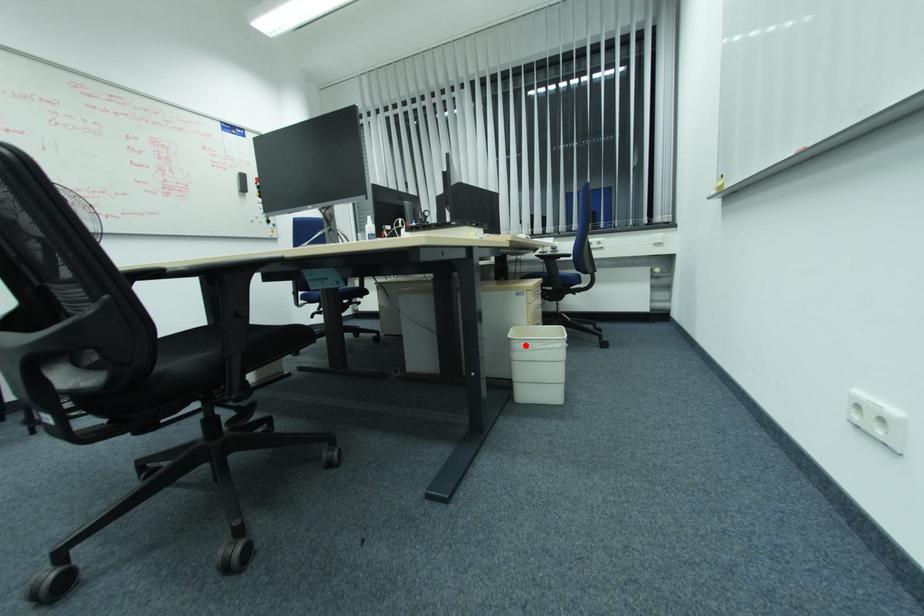
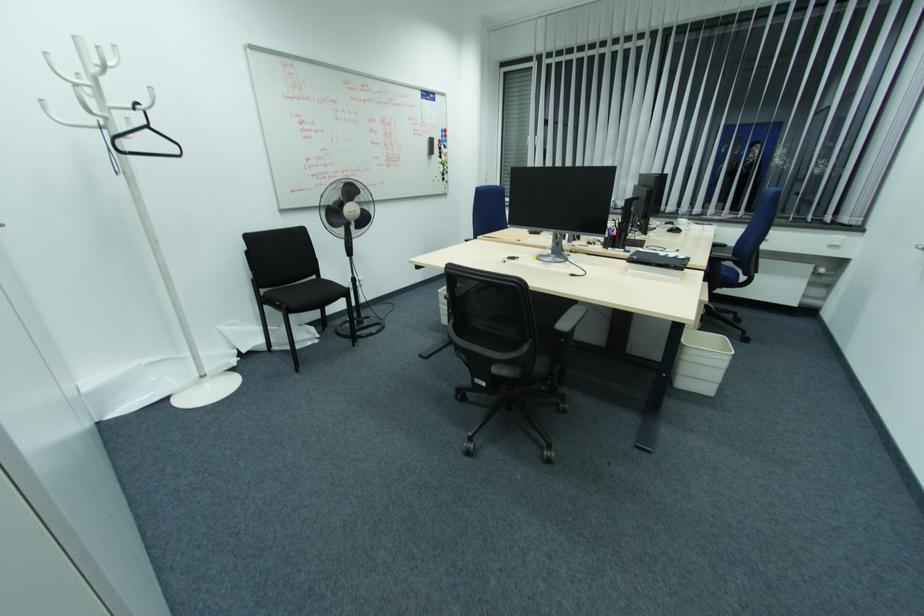
Question: I am providing you with two images of the same scene from different viewpoints. In image1, a red point is highlighted. Considering the same 3D point in image2, which of the following is correct?

Choices:
 (A) It is closer
 (B) It is farther

Answer: (A)